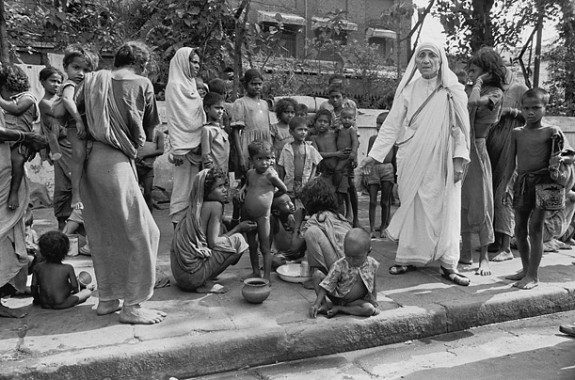
You are a GUI agent. You are given a task and a screenshot of the screen. Output one action in this format:
    pyautogui.click(x=<x>, y=<y>)
    Task: Click on the pot
    Image resolution: width=575 pixels, height=380 pixels.
    Given the screenshot: What is the action you would take?
    pyautogui.click(x=253, y=293)